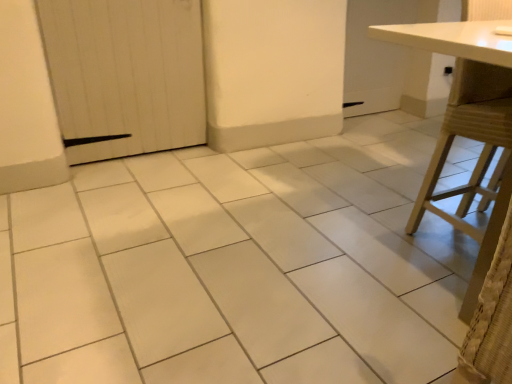
Describe the element at coordinates (125, 73) in the screenshot. I see `white wood door at left` at that location.

Identify the location of white wood door at left. The height and width of the screenshot is (384, 512). (125, 73).

Measure the distance between white wood door at left and camera.

A distance of 2.02 meters exists between white wood door at left and camera.

Where is `white matte table at right`? white matte table at right is located at coordinates (468, 75).

What do you see at coordinates (468, 75) in the screenshot? This screenshot has height=384, width=512. I see `white matte table at right` at bounding box center [468, 75].

Where is `white wood door at left`? This screenshot has width=512, height=384. white wood door at left is located at coordinates (125, 73).

Between white matte table at right and white wood door at left, which one appears on the right side from the viewer's perspective?

Positioned to the right is white matte table at right.

Is white matte table at right behind white wood door at left?

No.

Is point (463, 29) closer or farther from the camera than point (178, 18)?

Point (463, 29) is positioned closer to the camera compared to point (178, 18).

From the image's perspective, would you say white matte table at right is shown under white wood door at left?

Yes, from the image's perspective, white matte table at right is beneath white wood door at left.

From a real-world perspective, which object rests below the other?

white wood door at left is physically lower.

Is white matte table at right wider than white wood door at left?

Yes.

Can you confirm if white matte table at right is taller than white wood door at left?

Indeed, white matte table at right has a greater height compared to white wood door at left.

Considering the relative sizes of white matte table at right and white wood door at left in the image provided, is white matte table at right bigger than white wood door at left?

Yes, white matte table at right is bigger than white wood door at left.

Is white matte table at right outside of white wood door at left?

white matte table at right lies outside white wood door at left's area.

Is white matte table at right directly adjacent to white wood door at left?

No, white matte table at right is not with white wood door at left.

Consider the image. Is white matte table at right positioned with its back to white wood door at left?

No, white matte table at right is not facing away from white wood door at left.

At what (x,y) coordinates should I click in order to perform the action: click on table on the right of white wood door at left. Please return your answer as a coordinate pair (x, y). Looking at the image, I should click on (468, 75).

Which is more to the right, white wood door at left or white matte table at right?

Positioned to the right is white matte table at right.

Based on the photo, is white wood door at left in front of white matte table at right?

No, white wood door at left is further to the viewer.

Considering the points (137, 44) and (464, 131), which point is in front, point (137, 44) or point (464, 131)?

The point (464, 131) is closer.

From the image's perspective, is white wood door at left under white matte table at right?

No.

From a real-world perspective, is white wood door at left beneath white matte table at right?

Yes, from a real-world perspective, white wood door at left is under white matte table at right.

Looking at this image, which of these two, white wood door at left or white matte table at right, is thinner?

white wood door at left is thinner.

Can you confirm if white wood door at left is taller than white matte table at right?

No.

In terms of size, does white wood door at left appear bigger or smaller than white matte table at right?

white wood door at left is smaller than white matte table at right.

Which is correct: white wood door at left is inside white matte table at right, or outside of it?

white wood door at left lies outside white matte table at right.

Are white wood door at left and white matte table at right beside each other?

They are not placed beside each other.

Is white wood door at left positioned with its back to white matte table at right?

No, white wood door at left's orientation is not away from white matte table at right.

How distant is white wood door at left from white matte table at right?

white wood door at left and white matte table at right are 1.57 meters apart from each other.

This screenshot has height=384, width=512. In order to click on door on the left of white matte table at right in this screenshot , I will do `click(125, 73)`.

Identify the location of table that is on the right side of white wood door at left. This screenshot has width=512, height=384. (468, 75).

The width and height of the screenshot is (512, 384). I want to click on table above the white wood door at left (from a real-world perspective), so click(x=468, y=75).